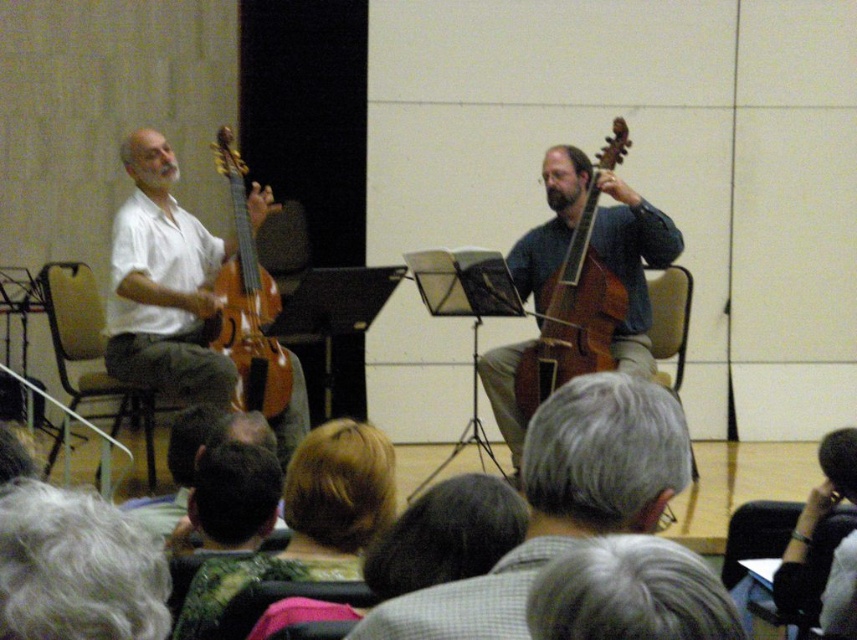
Question: Which point is closer to the camera?

Choices:
 (A) 594,177
 (B) 82,577
 (C) 180,368

Answer: (B)

Question: In this image, where is matte wood violin at left located relative to wooden varnished violin at left?

Choices:
 (A) below
 (B) above

Answer: (A)

Question: Which object appears farthest from the camera in this image?

Choices:
 (A) gray hair at center
 (B) gray hair at upper center

Answer: (A)

Question: Can you confirm if matte wood violin at left is wider than black leather glove at lower right?

Choices:
 (A) no
 (B) yes

Answer: (B)

Question: From the image, what is the correct spatial relationship of gray curly hair at lower left in relation to black leather glove at lower right?

Choices:
 (A) below
 (B) above

Answer: (B)

Question: Which object appears closest to the camera in this image?

Choices:
 (A) black leather glove at lower right
 (B) gray hair at center
 (C) matte wood violin at left

Answer: (B)